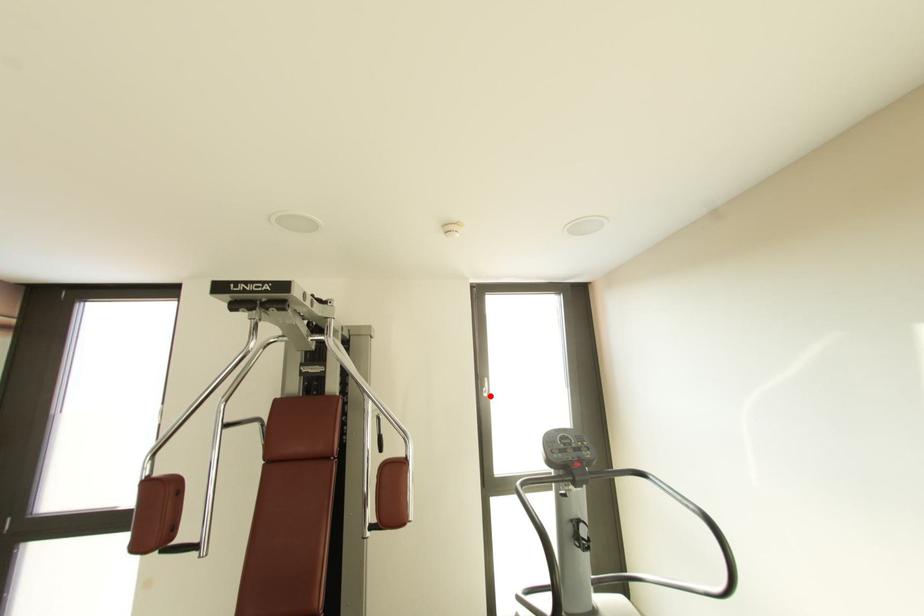
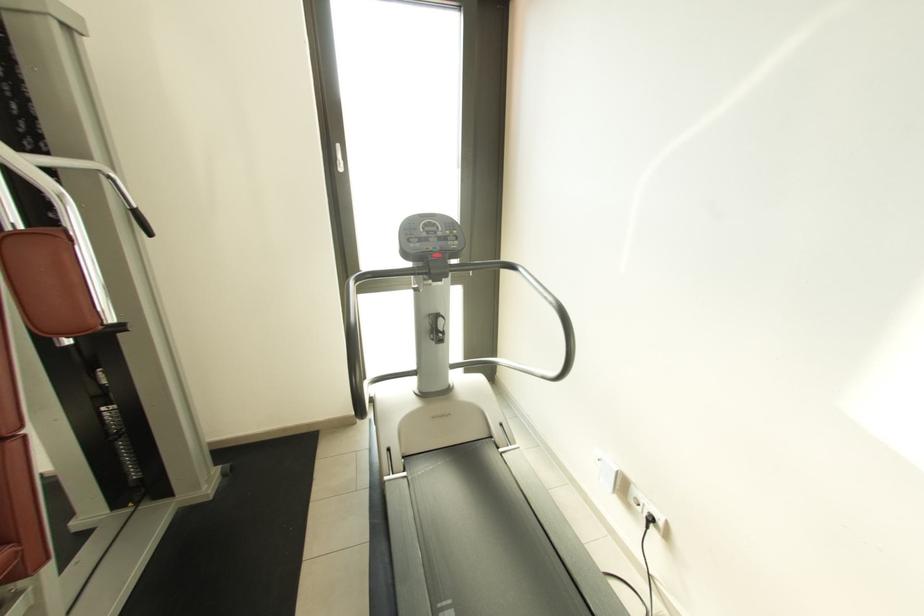
The point at the highlighted location is marked in the first image. Where is the corresponding point in the second image?

(345, 171)